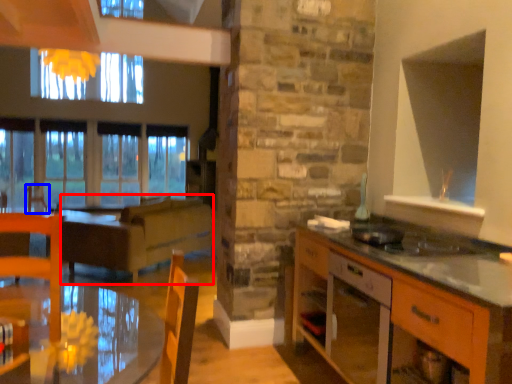
Question: Which point is closer to the camera, surround (highlighted by a red box) or armchair (highlighted by a blue box)?

Choices:
 (A) surround
 (B) armchair

Answer: (A)